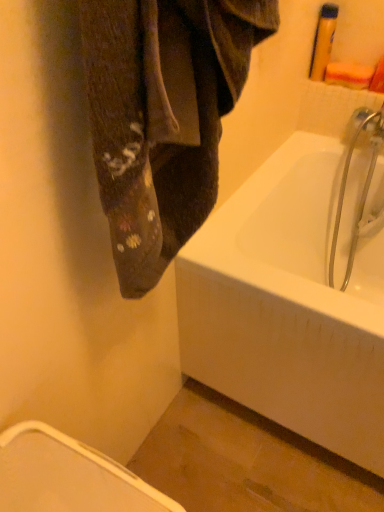
The height and width of the screenshot is (512, 384). What do you see at coordinates (323, 41) in the screenshot? I see `yellow plastic tube at upper right` at bounding box center [323, 41].

In order to face yellow plastic tube at upper right, should I rotate leftwards or rightwards?

Rotate right and turn 17.225 degrees.

I want to click on yellow plastic tube at upper right, so click(x=323, y=41).

Locate an element on the screen. yellow plastic tube at upper right is located at coordinates [323, 41].